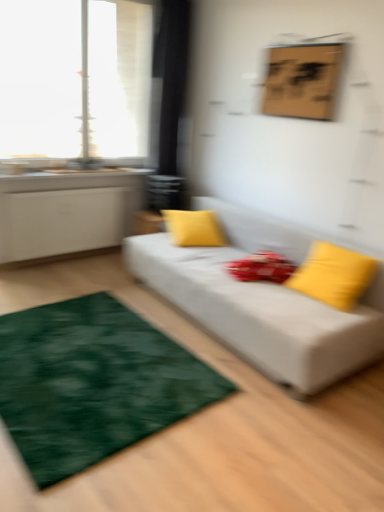
Image resolution: width=384 pixels, height=512 pixels. In order to click on vacant space positioned to the left of white fabric couch at center in this screenshot , I will do `click(94, 286)`.